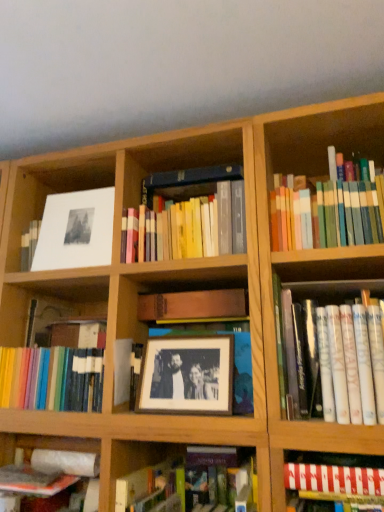
Question: Is hardcover books at center, the second book viewed from the top, not close to hardcover book at lower center, the second book in the bottom-to-top sequence?

Choices:
 (A) no
 (B) yes

Answer: (A)

Question: Does hardcover books at center, the second book viewed from the top, appear on the left side of hardcover book at lower center, the second book in the bottom-to-top sequence?

Choices:
 (A) yes
 (B) no

Answer: (B)

Question: Considering the relative positions of hardcover books at center, the second book viewed from the top, and hardcover book at lower center, the second book in the bottom-to-top sequence, in the image provided, is hardcover books at center, the second book viewed from the top, to the right of hardcover book at lower center, the second book in the bottom-to-top sequence, from the viewer's perspective?

Choices:
 (A) no
 (B) yes

Answer: (B)

Question: From the image's perspective, is hardcover books at center, the sixth book positioned from the bottom, above hardcover book at lower center, the second book in the bottom-to-top sequence?

Choices:
 (A) yes
 (B) no

Answer: (A)

Question: Is hardcover books at center, the second book viewed from the top, turned away from hardcover book at lower center, the second book in the bottom-to-top sequence?

Choices:
 (A) no
 (B) yes

Answer: (A)

Question: In terms of height, does wooden picture frame at center, the second picture frame viewed from the left, look taller or shorter compared to white paperback book at right, the third book positioned from the top?

Choices:
 (A) tall
 (B) short

Answer: (B)

Question: Looking at the image, does wooden picture frame at center, the 2th picture frame from the top, seem bigger or smaller compared to white paperback book at right, the third book positioned from the top?

Choices:
 (A) small
 (B) big

Answer: (A)

Question: From a real-world perspective, relative to white paperback book at right, the third book positioned from the top, is wooden picture frame at center, positioned as the 1th picture frame in right-to-left order, vertically above or below?

Choices:
 (A) above
 (B) below

Answer: (B)

Question: Is wooden picture frame at center, positioned as the 1th picture frame in right-to-left order, wider or thinner than white paperback book at right, the fifth book positioned from the bottom?

Choices:
 (A) thin
 (B) wide

Answer: (A)

Question: Is hardcover book at lower left, marked as the seventh book in a top-to-bottom arrangement, bigger or smaller than hardcover book at lower center, the second book in the bottom-to-top sequence?

Choices:
 (A) small
 (B) big

Answer: (A)

Question: From the image's perspective, relative to hardcover book at lower center, placed as the sixth book when sorted from top to bottom, is hardcover book at lower left, marked as the seventh book in a top-to-bottom arrangement, above or below?

Choices:
 (A) above
 (B) below

Answer: (B)

Question: Choose the correct answer: Is hardcover book at lower left, marked as the seventh book in a top-to-bottom arrangement, inside hardcover book at lower center, the second book in the bottom-to-top sequence, or outside it?

Choices:
 (A) outside
 (B) inside

Answer: (A)

Question: Considering their positions, is hardcover book at lower left, placed as the 1th book when sorted from bottom to top, located in front of or behind hardcover book at lower center, the second book in the bottom-to-top sequence?

Choices:
 (A) behind
 (B) front

Answer: (A)

Question: Is hardcover books at center, the second book viewed from the top, in front of or behind white paperback book at right, the third book positioned from the top, in the image?

Choices:
 (A) behind
 (B) front

Answer: (A)

Question: From the image's perspective, is hardcover books at center, the second book viewed from the top, above or below white paperback book at right, the third book positioned from the top?

Choices:
 (A) below
 (B) above

Answer: (B)